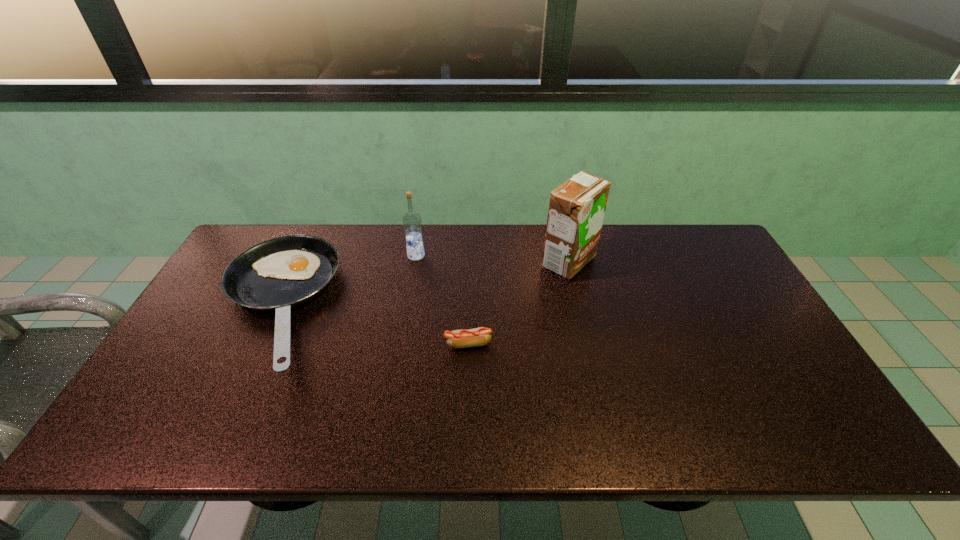
This screenshot has height=540, width=960. I want to click on free area in between the shortest object and the rightmost object, so click(x=518, y=303).

At what (x,y) coordinates should I click in order to perform the action: click on free spot between the carton and the sausage. Please return your answer as a coordinate pair (x, y). This screenshot has width=960, height=540. Looking at the image, I should click on (518, 303).

Identify the location of vacant area between the leftmost object and the carton. (421, 285).

Identify which object is the second nearest to the tallest object. Please provide its 2D coordinates. Your answer should be formatted as a tuple, i.e. [(x, y)], where the tuple contains the x and y coordinates of a point satisfying the conditions above.

[(412, 222)]

Locate an element on the screen. The width and height of the screenshot is (960, 540). object that stands as the closest to the shortest object is located at coordinates (577, 207).

This screenshot has width=960, height=540. What are the coordinates of `vacant point that satisfies the following two spatial constraints: 1. on the back side of the frying pan; 2. on the right side of the second tallest object` in the screenshot? It's located at (299, 255).

Locate an element on the screen. The height and width of the screenshot is (540, 960). free space in the image that satisfies the following two spatial constraints: 1. on the straw side of the rightmost object; 2. on the front side of the sausage is located at coordinates (588, 344).

Identify the location of free space that satisfies the following two spatial constraints: 1. on the straw side of the rightmost object; 2. on the front side of the sausage. This screenshot has width=960, height=540. (588, 344).